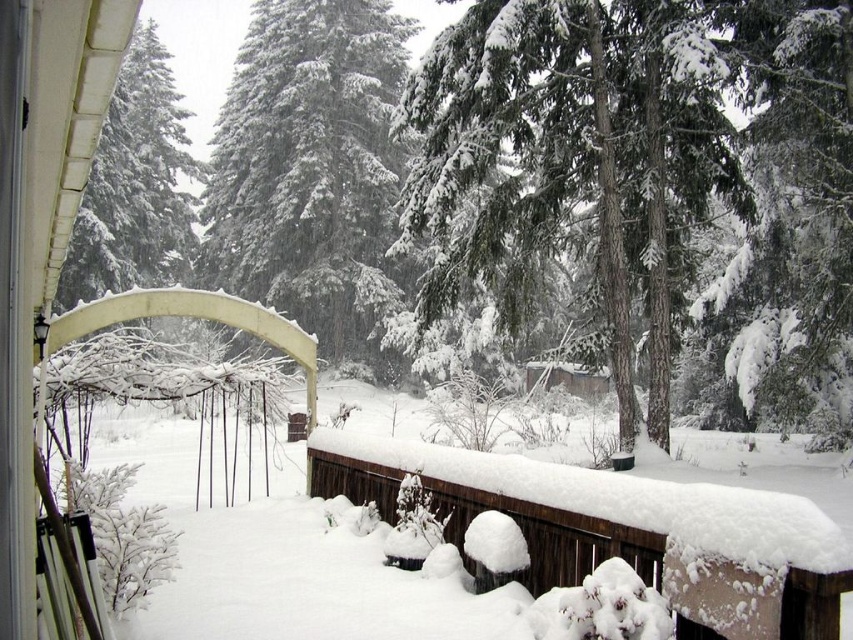
Question: In this image, where is snow-covered wooden deck at center located relative to white snow-covered tree at upper left?

Choices:
 (A) above
 (B) below

Answer: (B)

Question: Which is nearer to the green textured evergreen tree at center?

Choices:
 (A) white snow-covered tree at center
 (B) white snow-covered tree at upper left

Answer: (A)

Question: Which object is positioned closest to the snow-covered wooden deck at center?

Choices:
 (A) green textured evergreen tree at center
 (B) white snow-covered tree at center
 (C) white snow-covered tree at upper left

Answer: (A)

Question: Can you confirm if white snow-covered tree at center is positioned to the left of white snow-covered tree at upper left?

Choices:
 (A) yes
 (B) no

Answer: (B)

Question: Among these objects, which one is farthest from the camera?

Choices:
 (A) snow-covered wooden deck at center
 (B) white snow-covered tree at center

Answer: (B)

Question: Can you confirm if green textured evergreen tree at center is positioned below white snow-covered tree at center?

Choices:
 (A) no
 (B) yes

Answer: (B)